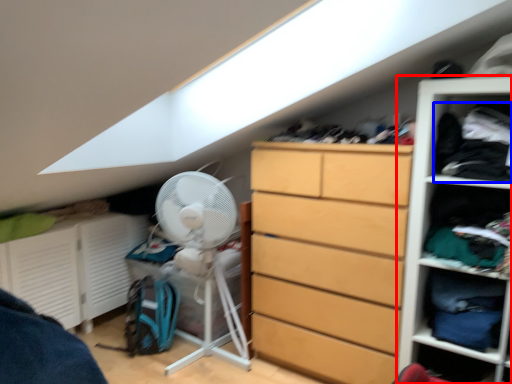
Question: Among these objects, which one is farthest to the camera, shelf (highlighted by a red box) or clothing (highlighted by a blue box)?

Choices:
 (A) shelf
 (B) clothing

Answer: (B)